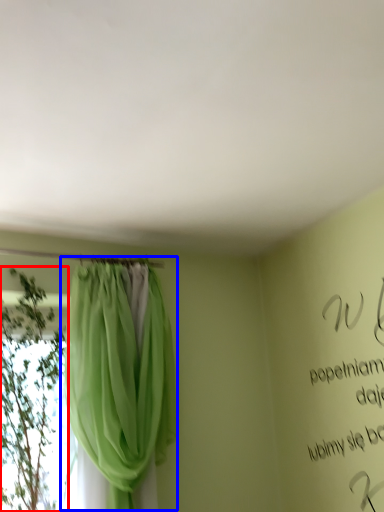
Question: Which of the following is the closest to the observer, plant (highlighted by a red box) or curtain (highlighted by a blue box)?

Choices:
 (A) plant
 (B) curtain

Answer: (B)